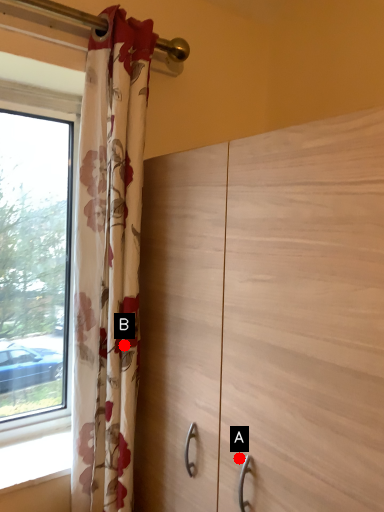
Question: Two points are circled on the image, labeled by A and B beside each circle. Which point is farther from the camera taking this photo?

Choices:
 (A) A is further
 (B) B is further

Answer: (B)